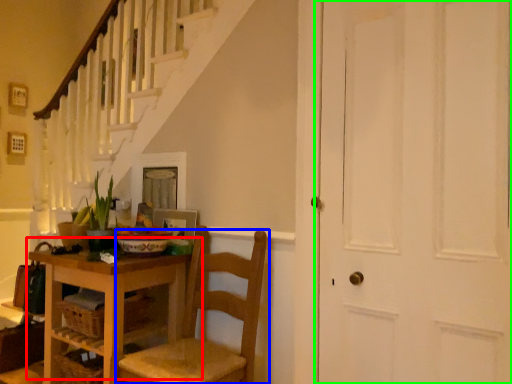
Question: Based on their relative distances, which object is nearer to table (highlighted by a red box)? Choose from chair (highlighted by a blue box) and door (highlighted by a green box).

Choices:
 (A) chair
 (B) door

Answer: (A)